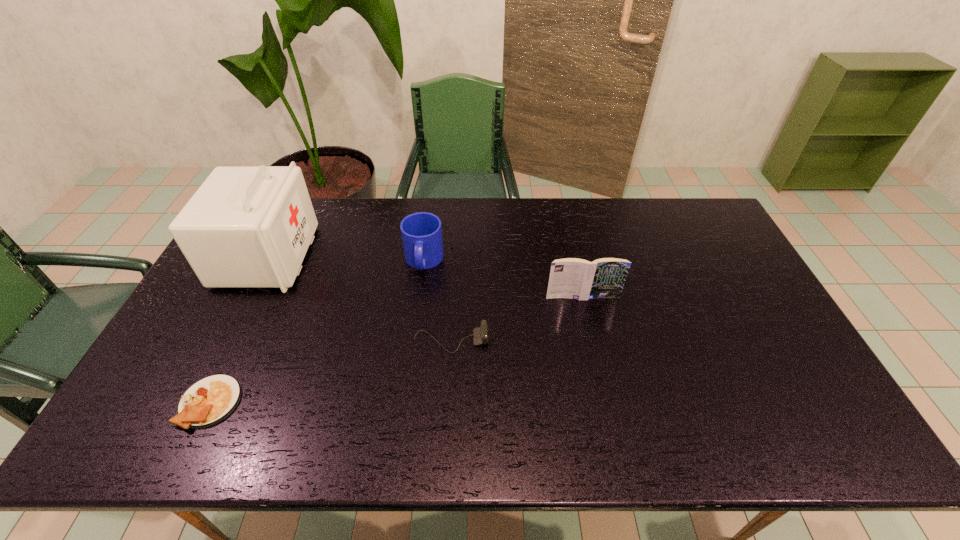
Find the location of a particular element. This screenshot has height=540, width=960. the tallest object is located at coordinates pyautogui.click(x=246, y=226).

This screenshot has width=960, height=540. In order to click on the rightmost object in this screenshot , I will do `click(573, 278)`.

This screenshot has height=540, width=960. Identify the location of mug. (421, 232).

Locate an element on the screen. the second nearest object is located at coordinates (480, 334).

Where is `webcam`? The image size is (960, 540). webcam is located at coordinates (480, 334).

Locate an element on the screen. The height and width of the screenshot is (540, 960). the nearest object is located at coordinates (210, 400).

You are a GUI agent. You are given a task and a screenshot of the screen. Output one action in this format:
    pyautogui.click(x=<x>, y=<y>)
    Task: Click on the shortest object
    
    Given the screenshot: What is the action you would take?
    tap(210, 400)

Where is `free region located 0.380m on the front-facing side of the tallest object`? The image size is (960, 540). free region located 0.380m on the front-facing side of the tallest object is located at coordinates (423, 256).

Identify the location of blank space located on the front cover of the rightmost object. (587, 313).

The height and width of the screenshot is (540, 960). What are the coordinates of `free location located on the side with the handle of the mug` in the screenshot? It's located at (408, 382).